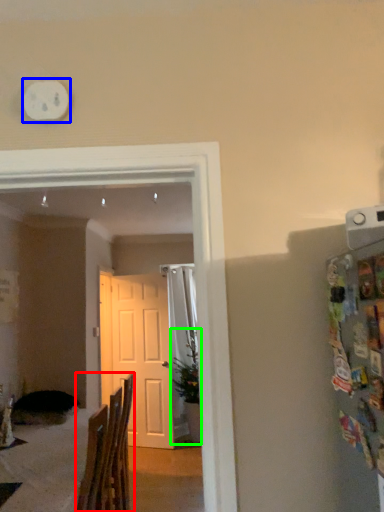
Question: Based on their relative distances, which object is nearer to chair (highlighted by a red box)? Choose from clock (highlighted by a blue box) and houseplant (highlighted by a green box).

Choices:
 (A) clock
 (B) houseplant

Answer: (A)